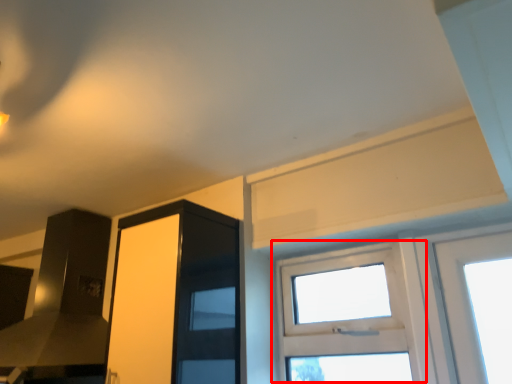
Question: From the image's perspective, where is window (annotated by the red box) located in relation to screen door in the image?

Choices:
 (A) below
 (B) above

Answer: (A)